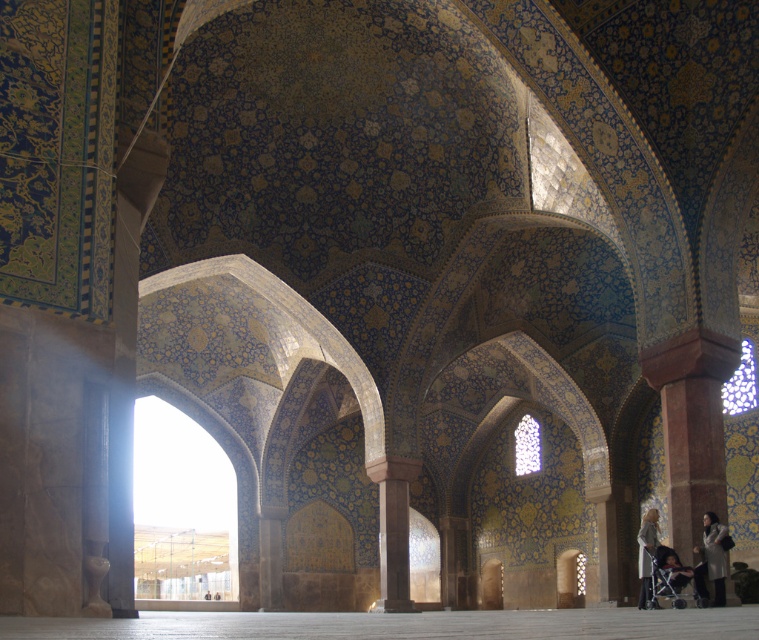
You are a visitor standing at the entrance of the mosque and see two coats hanging at the lower right corner. You need to retrieve your silver metallic coat at lower right. Can you reach it without stepping over the gray wool coat at lower right?

The silver metallic coat at lower right and gray wool coat at lower right are 5.59 meters apart from each other, so you can reach the silver metallic coat at lower right without stepping over the gray wool coat at lower right since they are far apart.

You are visiting this mosque and see a metallic silver baby carriage at lower right and a gray wool coat at lower right. Which object is placed higher from the floor?

The metallic silver baby carriage at lower right is above the gray wool coat at lower right, so it is placed higher from the floor.